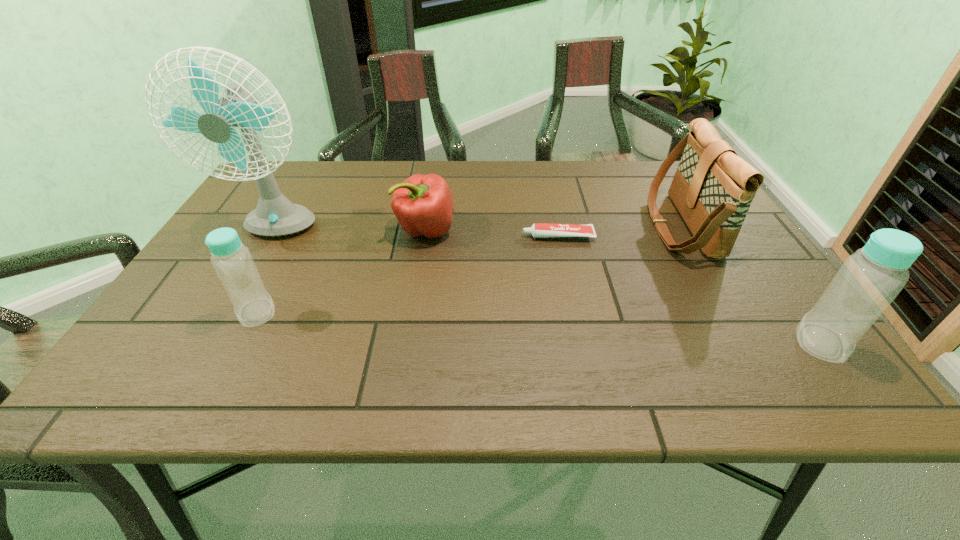
Where is `unoccupied position between the bell pepper and the fan`? The height and width of the screenshot is (540, 960). unoccupied position between the bell pepper and the fan is located at coordinates (350, 231).

This screenshot has width=960, height=540. I want to click on vacant point located between the fifth tallest object and the fan, so click(x=350, y=231).

This screenshot has width=960, height=540. I want to click on the fourth closest object relative to the right bottle, so click(275, 215).

Locate which object ranks second in proximity to the shortest object. Please provide its 2D coordinates. Your answer should be formatted as a tuple, i.e. [(x, y)], where the tuple contains the x and y coordinates of a point satisfying the conditions above.

[(423, 204)]

Identify the location of blank area in the image that satisfies the following two spatial constraints: 1. on the back side of the shorter bottle; 2. on the right side of the bell pepper. The image size is (960, 540). (300, 230).

This screenshot has height=540, width=960. What are the coordinates of `vacant region that satisfies the following two spatial constraints: 1. on the front-facing side of the second object from right to left; 2. on the front-facing side of the tallest object` in the screenshot? It's located at (684, 231).

What are the coordinates of `vacant position in the image that satisfies the following two spatial constraints: 1. on the back side of the right bottle; 2. at the nozzle of the fourth object from left to right` in the screenshot? It's located at (744, 237).